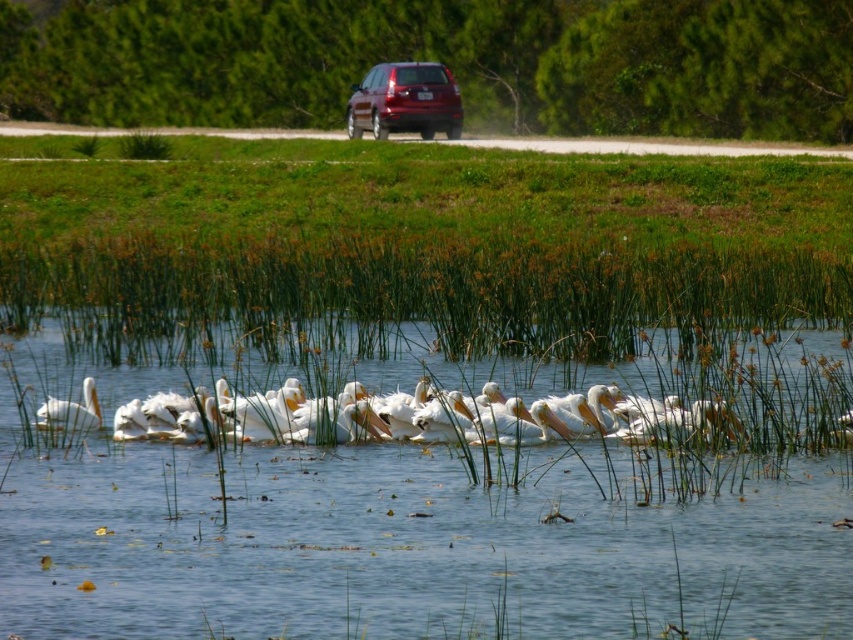
You are standing at the center of the dirt road in the scene. You want to walk to the shiny red suv at center. Which direction should you head towards?

The shiny red suv at center is located at point (405, 100). Since you are at the center of the dirt road, you should head towards the upper middle part of the frame to reach it.

You are a bird flying over the scene and want to land on the clear water at center. What are the coordinates where you should aim to land?

The clear water at center is located at coordinates point (x=410, y=545), so you should aim for those coordinates to land.